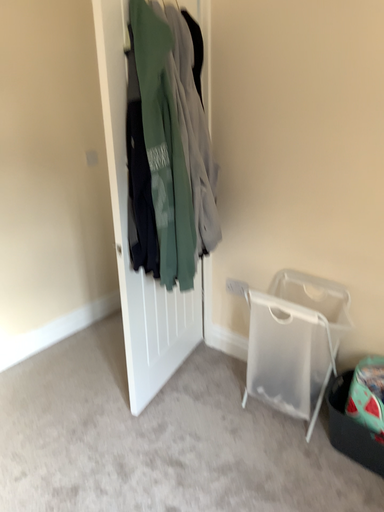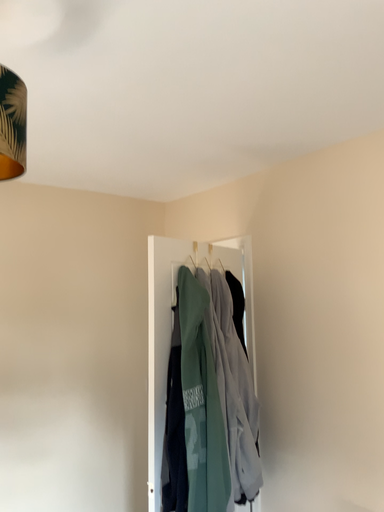
Question: Which way did the camera rotate in the video?

Choices:
 (A) rotated right
 (B) rotated left

Answer: (B)